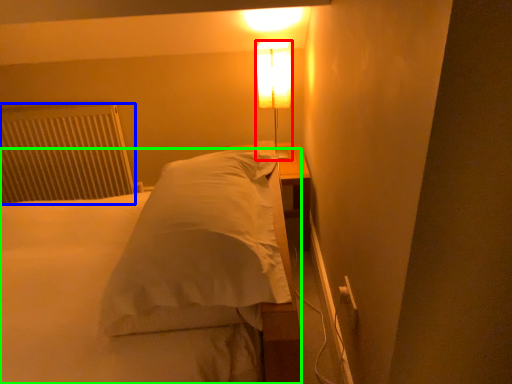
Question: Considering the real-world distances, which object is closest to lamp (highlighted by a red box)? radiator (highlighted by a blue box) or bed (highlighted by a green box).

Choices:
 (A) radiator
 (B) bed

Answer: (B)